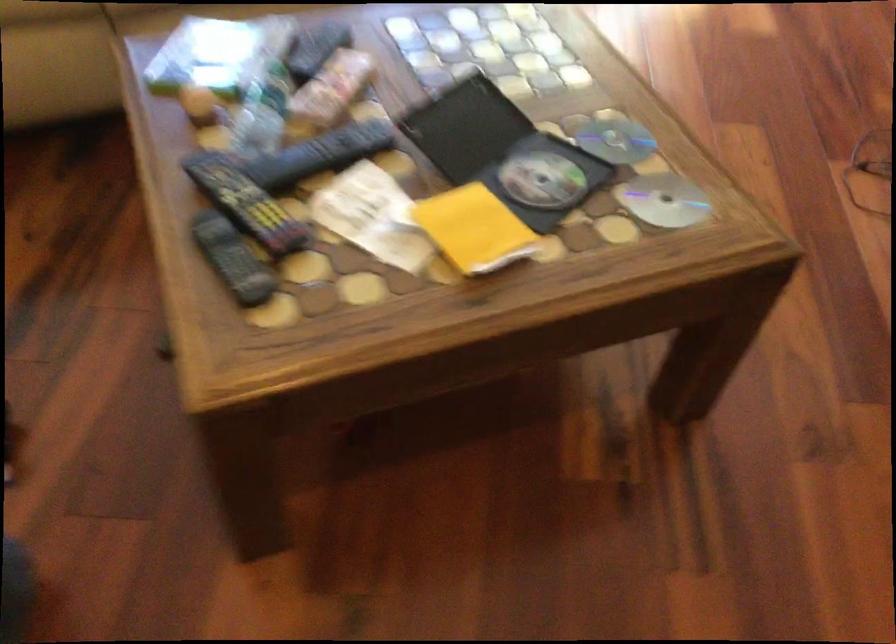
I want to click on plastic water bottle, so click(x=262, y=113).